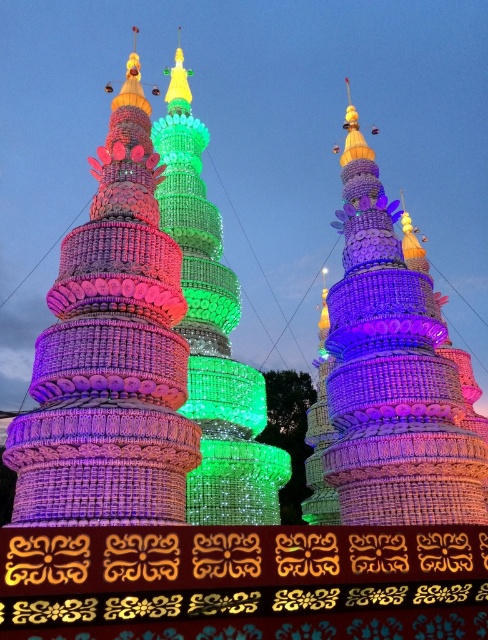
Question: Which point is farther to the camera?

Choices:
 (A) (199, 355)
 (B) (378, 209)

Answer: (A)

Question: Among these points, which one is farthest from the camera?

Choices:
 (A) click(216, 298)
 (B) click(336, 426)
 (C) click(116, 436)

Answer: (A)

Question: Does multicolored glass beads at center appear on the right side of green glass tower at center?

Choices:
 (A) yes
 (B) no

Answer: (A)

Question: Which of these objects is positioned closest to the matte purple tower at left?

Choices:
 (A) multicolored glass beads at center
 (B) green glass tower at center

Answer: (B)

Question: Is multicolored glass beads at center thinner than green glass tower at center?

Choices:
 (A) no
 (B) yes

Answer: (B)

Question: Is the position of matte purple tower at left more distant than that of green glass tower at center?

Choices:
 (A) yes
 (B) no

Answer: (B)